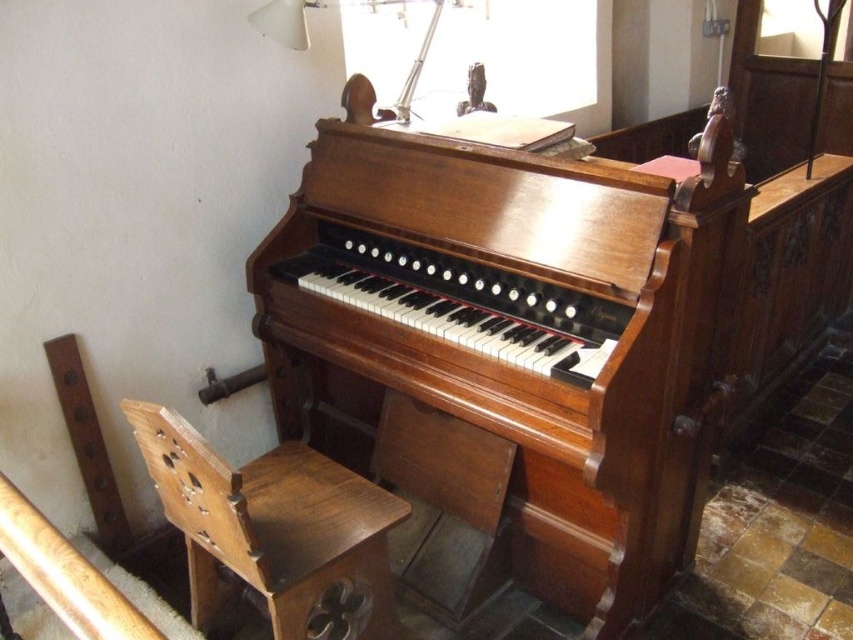
Which is more to the right, shiny brown piano at center or white plastic lamp at upper center?

Positioned to the right is shiny brown piano at center.

Identify the location of shiny brown piano at center. 512,342.

Does point (613, 381) lie in front of point (401, 88)?

Yes, point (613, 381) is closer to viewer.

What are the coordinates of `shiny brown piano at center` in the screenshot? It's located at (512, 342).

Does shiny brown piano at center appear on the left side of brown wooden chair at lower left?

Incorrect, shiny brown piano at center is not on the left side of brown wooden chair at lower left.

Is shiny brown piano at center to the right of brown wooden chair at lower left from the viewer's perspective?

Indeed, shiny brown piano at center is positioned on the right side of brown wooden chair at lower left.

Locate an element on the screen. shiny brown piano at center is located at coordinates (512, 342).

I want to click on shiny brown piano at center, so click(x=512, y=342).

Is brown wooden chair at lower left positioned in front of white plastic lamp at upper center?

Yes, it is in front of white plastic lamp at upper center.

Does brown wooden chair at lower left appear under white plastic lamp at upper center?

Yes, brown wooden chair at lower left is below white plastic lamp at upper center.

Where is `brown wooden chair at lower left`? The height and width of the screenshot is (640, 853). brown wooden chair at lower left is located at coordinates (274, 531).